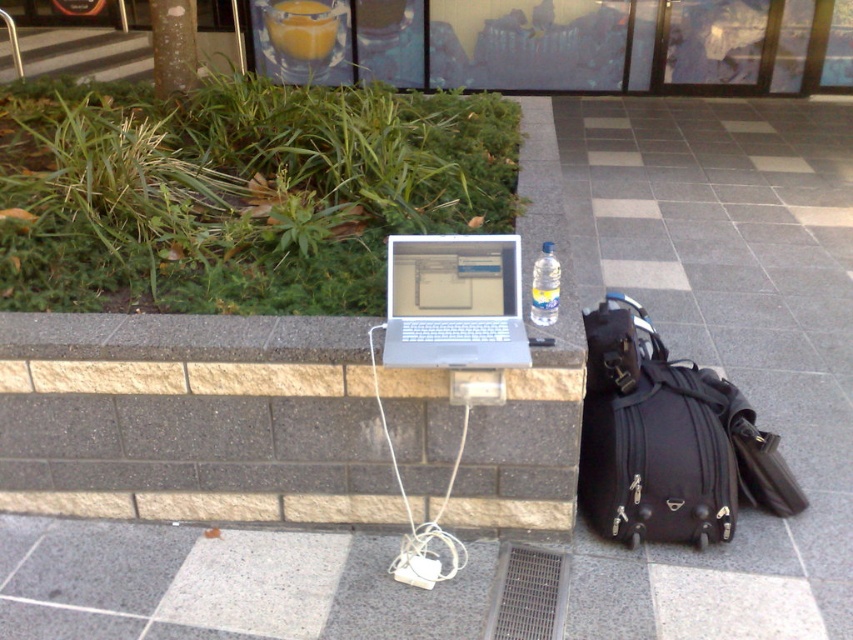
You are a traveler who just arrived at the urban park. You need to pack your silver metallic laptop at center into your black fabric backpack at lower right. Will the backpack fit the laptop?

The black fabric backpack at lower right has a larger size compared to the silver metallic laptop at center, so the backpack should be able to fit the laptop.

You are a delivery person who needs to move a package from the gray concrete stairs at upper left to the smooth gray pavement at right. What is the shortest distance you can take between the two locations?

The shortest distance between the gray concrete stairs at upper left and the smooth gray pavement at right is 4.71 meters.